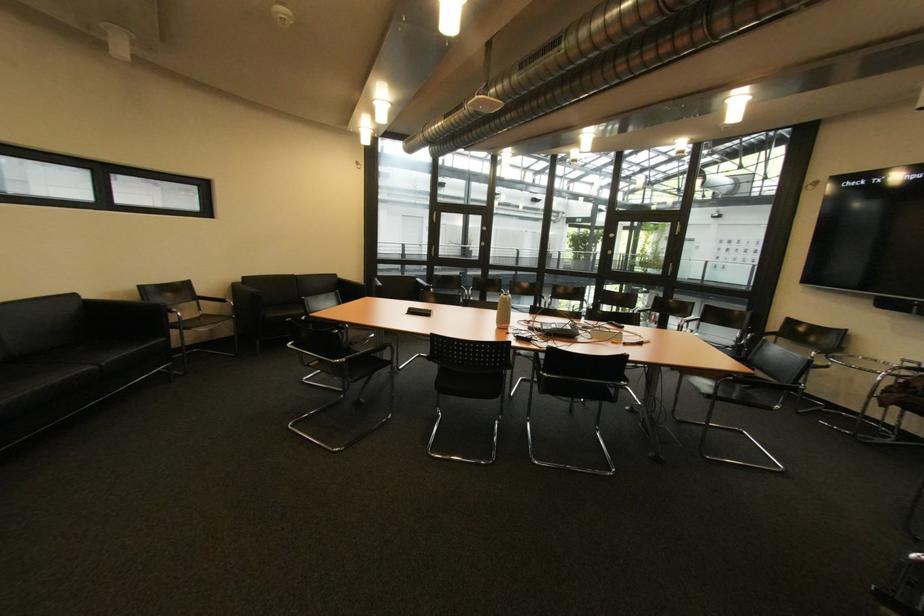
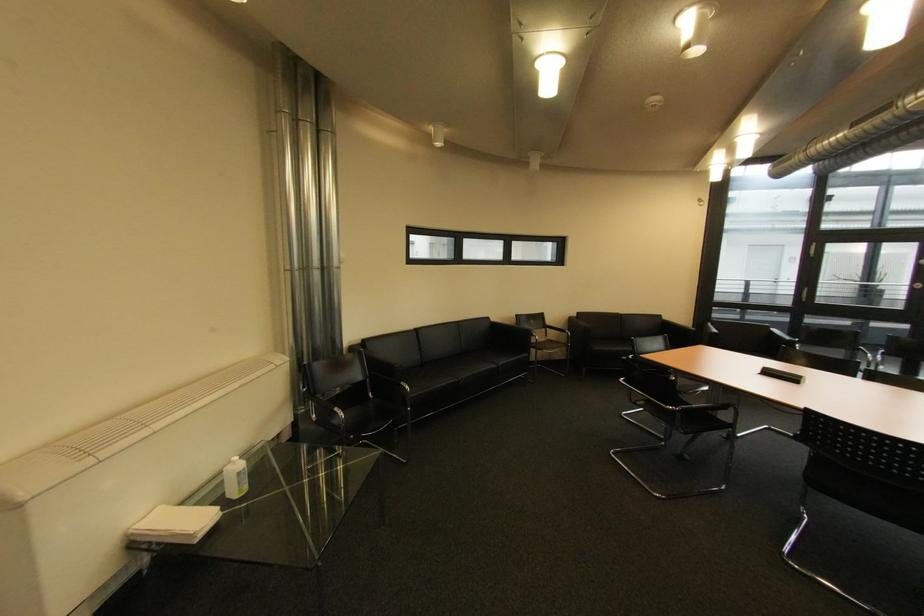
The point at (209, 302) is marked in the first image. Where is the corresponding point in the second image?

(555, 330)